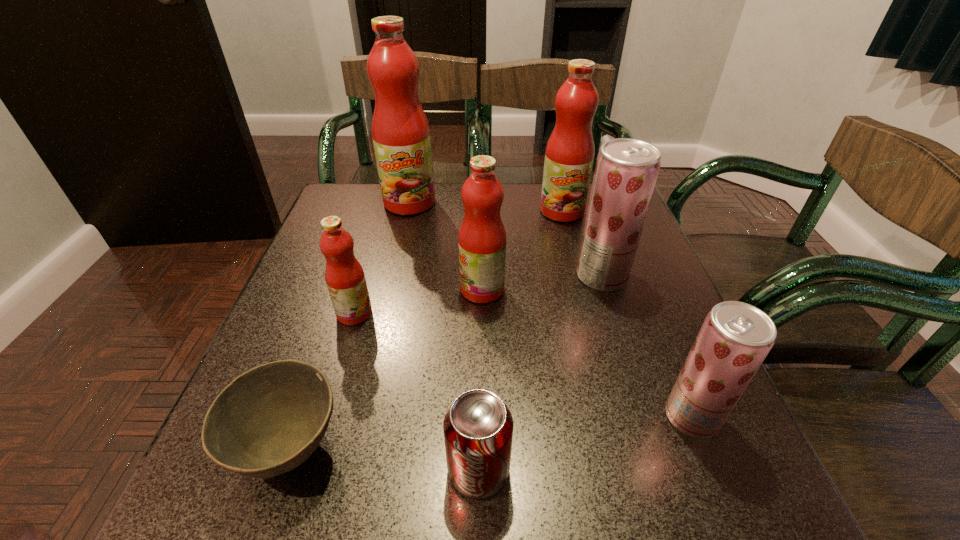
The width and height of the screenshot is (960, 540). What are the coordinates of `soda can` in the screenshot? It's located at (478, 427).

Find the location of `bowl`. bowl is located at coordinates (270, 419).

Find the location of `vacant region located 0.390m on the front label of the tallest fruit juice`. vacant region located 0.390m on the front label of the tallest fruit juice is located at coordinates (381, 326).

The width and height of the screenshot is (960, 540). What are the coordinates of `vacant space located on the front label of the rightmost pink fruit juice` in the screenshot? It's located at (578, 274).

You are a GUI agent. You are given a task and a screenshot of the screen. Output one action in this format:
    pyautogui.click(x=<x>, y=<y>)
    Task: Click on the vacant region located on the front of the farther strawberry fruit juice
    This screenshot has width=960, height=540.
    Given the screenshot: What is the action you would take?
    660,456

Image resolution: width=960 pixels, height=540 pixels. What are the coordinates of `vacant space situated 0.360m on the front label of the second pink fruit juice from right to left` in the screenshot? It's located at (293, 289).

What are the coordinates of `blank space located 0.100m on the front label of the second pink fruit juice from right to left` in the screenshot? It's located at (414, 289).

In order to click on vacant space located on the front label of the second pink fruit juice from right to left in this screenshot , I will do `click(423, 289)`.

Locate an element on the screen. This screenshot has height=540, width=960. free location located 0.390m on the front label of the smallest pink fruit juice is located at coordinates (564, 313).

Locate an element on the screen. free space located 0.090m on the front of the nearer strawberry fruit juice is located at coordinates (726, 501).